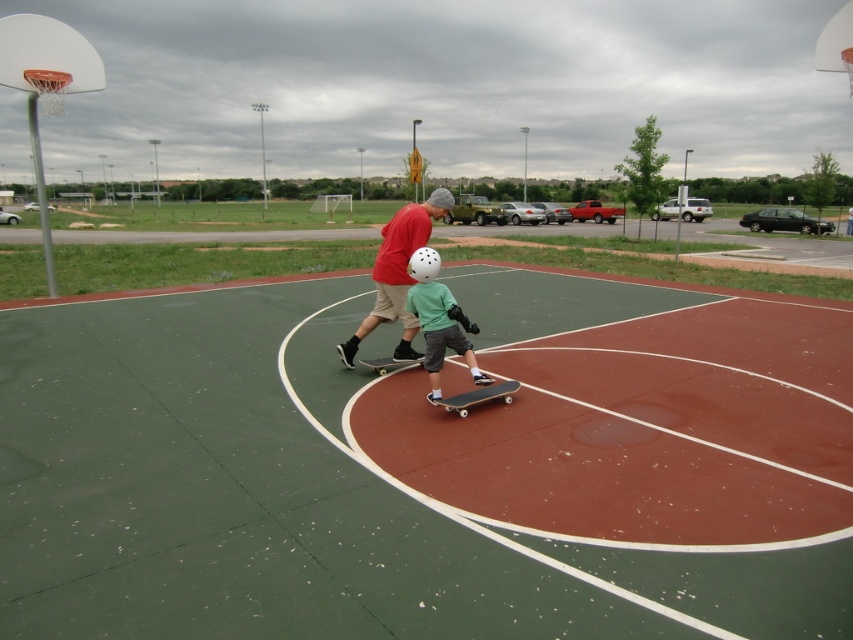
Question: Does matte black skateboard at center have a greater width compared to green matte shirt at center?

Choices:
 (A) yes
 (B) no

Answer: (A)

Question: Does green matte shirt at center appear on the left side of metallic silver skateboard at center?

Choices:
 (A) no
 (B) yes

Answer: (A)

Question: Which point is closer to the camera?

Choices:
 (A) green matte shirt at center
 (B) wooden smooth skateboard at center
 (C) white plastic basketball hoop at upper left
 (D) metallic silver skateboard at center

Answer: (A)

Question: Which of the following is the farthest from the observer?

Choices:
 (A) (30, 84)
 (B) (477, 394)
 (C) (422, 355)

Answer: (A)

Question: Among these objects, which one is farthest from the camera?

Choices:
 (A) matte black skateboard at center
 (B) wooden smooth skateboard at center
 (C) metallic silver skateboard at center

Answer: (C)

Question: In this image, where is wooden smooth skateboard at center located relative to metallic silver skateboard at center?

Choices:
 (A) left
 (B) right

Answer: (B)